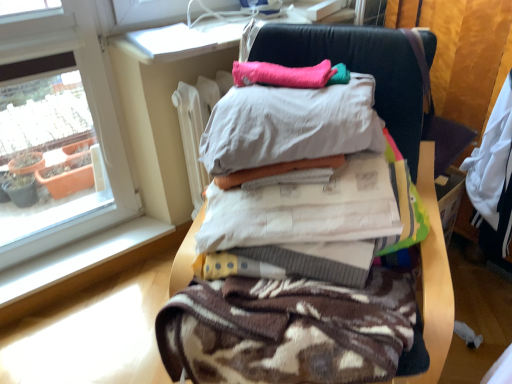
Question: From the image's perspective, is brown textured blanket at center located above or below dark blue leather chair at right?

Choices:
 (A) above
 (B) below

Answer: (B)

Question: Visually, is brown textured blanket at center positioned to the left or to the right of dark blue leather chair at right?

Choices:
 (A) right
 (B) left

Answer: (B)

Question: Estimate the real-world distances between objects in this image. Which object is farther from the brown textured blanket at center?

Choices:
 (A) brown textured blanket at center
 (B) dark blue leather chair at right
 (C) pink fabric pillow at upper center

Answer: (B)

Question: Estimate the real-world distances between objects in this image. Which object is farther from the dark blue leather chair at right?

Choices:
 (A) pink fabric pillow at upper center
 (B) brown textured blanket at center
 (C) brown textured blanket at center

Answer: (C)